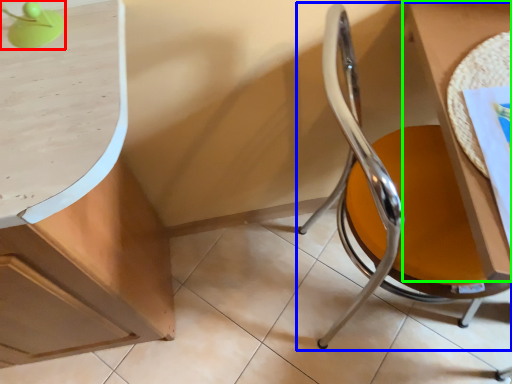
Question: Which object is the farthest from table lamp (highlighted by a red box)? Choose among these: chair (highlighted by a blue box) or table (highlighted by a green box).

Choices:
 (A) chair
 (B) table

Answer: (B)